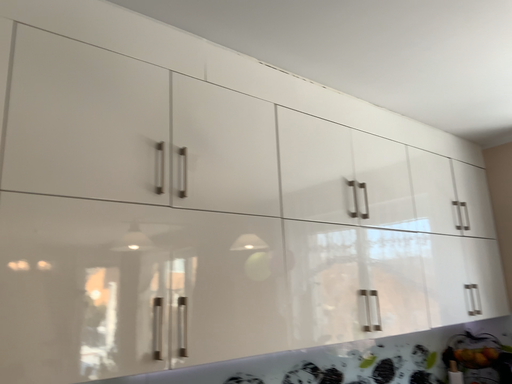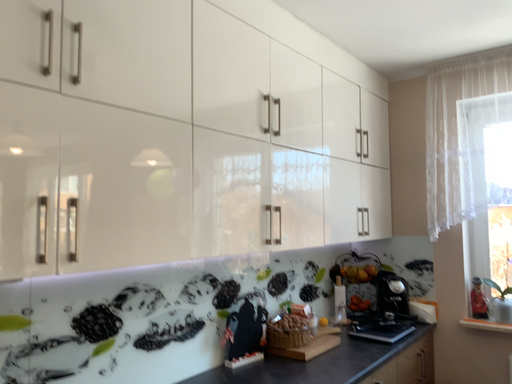
Question: Which way did the camera rotate in the video?

Choices:
 (A) rotated right
 (B) rotated left

Answer: (A)